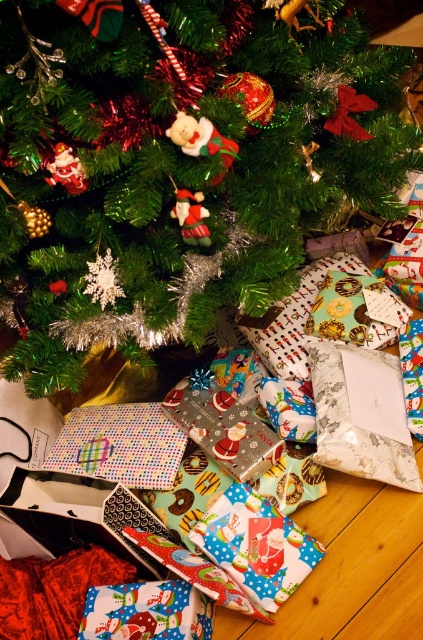
You are standing in front of the festive scene described. There is a point marked at coordinates (180, 164). What object is located at this point?

The green matte christmas tree at center is located at point (180, 164).

You are standing in front of the Christmas tree and see the gifts under it. There is a point marked at coordinates (255,545). What is the gift at this point wrapped in?

The point at (255,545) marks the Santa themed paper at lower center, so the gift at this point is wrapped in Santa themed paper.

You are standing in front of the Christmas tree and want to reach a specific gift located at point [346,180]. Your arm can extend 40 inches. Can you reach the gift without moving your feet?

The point [346,180] is 39.21 inches away from the camera, so yes, you can reach it with your arm extended 40 inches since it is within reach.